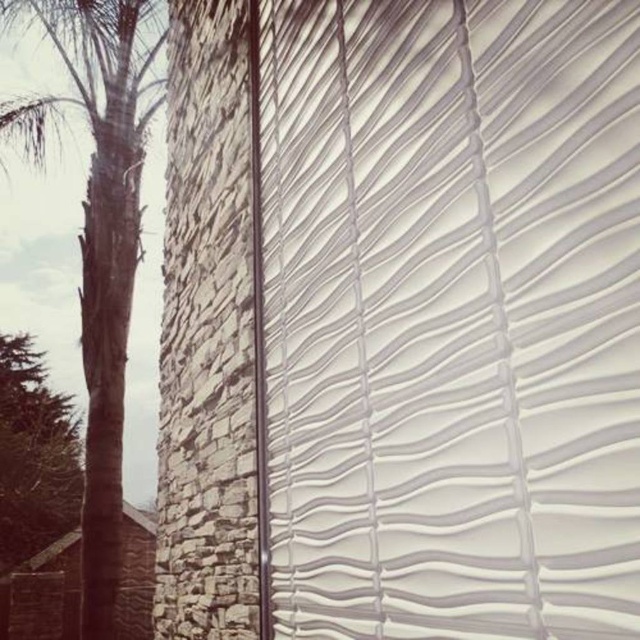
How much distance is there between white textured blind at center and brown textured palm tree at left?

white textured blind at center and brown textured palm tree at left are 23.48 feet apart from each other.

Which of these two, white textured blind at center or brown textured palm tree at left, stands shorter?

white textured blind at center

Who is more distant from viewer, (372, 150) or (108, 38)?

The point (108, 38) is behind.

I want to click on white textured blind at center, so click(x=451, y=316).

Does point (634, 97) lie in front of point (45, 490)?

Yes, it is in front of point (45, 490).

Between white textured blind at center and green leafy tree at left, which one is positioned lower?

Positioned lower is green leafy tree at left.

Which is behind, point (269, 77) or point (4, 396)?

The point (4, 396) is behind.

Locate an element on the screen. Image resolution: width=640 pixels, height=640 pixels. white textured blind at center is located at coordinates (451, 316).

Can you confirm if brown textured palm tree at left is bigger than green leafy tree at left?

Yes, brown textured palm tree at left is bigger than green leafy tree at left.

Which is below, brown textured palm tree at left or green leafy tree at left?

green leafy tree at left is lower down.

Between point (90, 225) and point (40, 502), which one is positioned behind?

Point (40, 502)

I want to click on brown textured palm tree at left, so click(x=106, y=243).